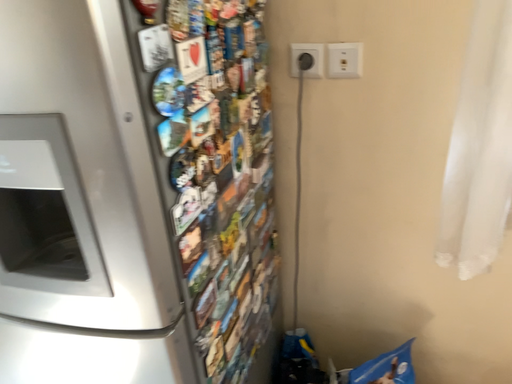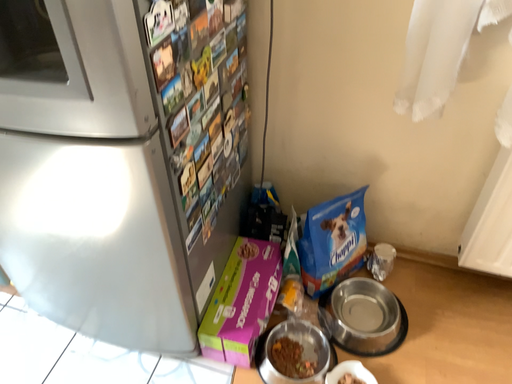
Question: How did the camera likely rotate when shooting the video?

Choices:
 (A) rotated upward
 (B) rotated downward

Answer: (B)